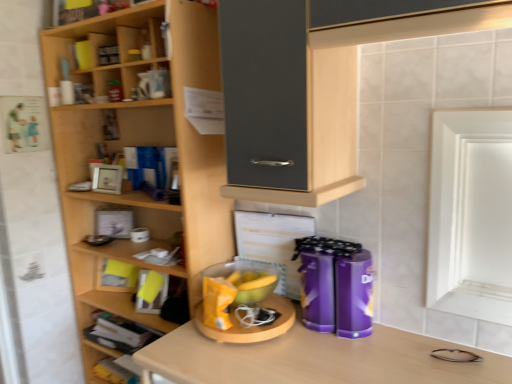
From the picture: Measure the distance between wooden books at lower left, which ranks as the 2th shelf in top-to-bottom order, and camera.

wooden books at lower left, which ranks as the 2th shelf in top-to-bottom order, is 1.75 meters away from camera.

Where is `wooden books at lower left, the second shelf positioned from the bottom`? The image size is (512, 384). wooden books at lower left, the second shelf positioned from the bottom is located at coordinates (120, 332).

The image size is (512, 384). What do you see at coordinates (139, 145) in the screenshot?
I see `wooden shelves at left, arranged as the 1th shelf when viewed from the top` at bounding box center [139, 145].

The height and width of the screenshot is (384, 512). Describe the element at coordinates (335, 286) in the screenshot. I see `purple glossy canisters at center, placed as the second appliance when sorted from left to right` at that location.

Locate an element on the screen. wooden books at lower left, which ranks as the 2th shelf in top-to-bottom order is located at coordinates [x=120, y=332].

Based on the photo, would you say purple glossy canisters at center, arranged as the first appliance when viewed from the right, is part of wooden books at lower left, which ranks as the 2th shelf in top-to-bottom order,'s contents?

No, purple glossy canisters at center, arranged as the first appliance when viewed from the right, is located outside of wooden books at lower left, which ranks as the 2th shelf in top-to-bottom order.

Considering the relative sizes of wooden books at lower left, which ranks as the 2th shelf in top-to-bottom order, and purple glossy canisters at center, arranged as the first appliance when viewed from the right, in the image provided, is wooden books at lower left, which ranks as the 2th shelf in top-to-bottom order, shorter than purple glossy canisters at center, arranged as the first appliance when viewed from the right,?

Yes.

From the image's perspective, does wooden books at lower left, which ranks as the 2th shelf in top-to-bottom order, appear lower than purple glossy canisters at center, arranged as the first appliance when viewed from the right?

Yes, from the image's perspective, wooden books at lower left, which ranks as the 2th shelf in top-to-bottom order, is beneath purple glossy canisters at center, arranged as the first appliance when viewed from the right.

Between wooden books at lower left, the second shelf positioned from the bottom, and purple glossy canisters at center, placed as the second appliance when sorted from left to right, which one appears on the right side from the viewer's perspective?

purple glossy canisters at center, placed as the second appliance when sorted from left to right.

Does wooden desk at center come behind wooden shelf at lower left, acting as the 3th shelf starting from the top?

That is False.

From the image's perspective, which one is positioned higher, wooden desk at center or wooden shelf at lower left, acting as the 3th shelf starting from the top?

wooden desk at center is shown above in the image.

From a real-world perspective, does wooden desk at center sit lower than wooden shelf at lower left, which is the 1th shelf from bottom to top?

Actually, wooden desk at center is physically above wooden shelf at lower left, which is the 1th shelf from bottom to top, in the real world.

Considering the sizes of objects purple glossy canisters at center, arranged as the first appliance when viewed from the right, and wooden books at lower left, the second shelf positioned from the bottom, in the image provided, who is smaller, purple glossy canisters at center, arranged as the first appliance when viewed from the right, or wooden books at lower left, the second shelf positioned from the bottom,?

With smaller size is purple glossy canisters at center, arranged as the first appliance when viewed from the right.

Which is more to the right, purple glossy canisters at center, arranged as the first appliance when viewed from the right, or wooden books at lower left, the second shelf positioned from the bottom?

Positioned to the right is purple glossy canisters at center, arranged as the first appliance when viewed from the right.

Does purple glossy canisters at center, placed as the second appliance when sorted from left to right, have a lesser height compared to wooden books at lower left, the second shelf positioned from the bottom?

In fact, purple glossy canisters at center, placed as the second appliance when sorted from left to right, may be taller than wooden books at lower left, the second shelf positioned from the bottom.

Could you tell me if purple glossy canisters at center, arranged as the first appliance when viewed from the right, is turned towards wooden books at lower left, which ranks as the 2th shelf in top-to-bottom order?

No.

Consider the image. Measure the distance from wooden shelves at left, arranged as the 1th shelf when viewed from the top, to wooden books at lower left, which ranks as the 2th shelf in top-to-bottom order.

wooden shelves at left, arranged as the 1th shelf when viewed from the top, is 21.21 inches from wooden books at lower left, which ranks as the 2th shelf in top-to-bottom order.

Based on their sizes in the image, would you say wooden shelves at left, arranged as the 1th shelf when viewed from the top, is bigger or smaller than wooden books at lower left, the second shelf positioned from the bottom?

Considering their sizes, wooden shelves at left, arranged as the 1th shelf when viewed from the top, takes up more space than wooden books at lower left, the second shelf positioned from the bottom.

Find the location of a particular element. shelf in front of the wooden books at lower left, which ranks as the 2th shelf in top-to-bottom order is located at coordinates (x=139, y=145).

Is wooden shelves at left, the third shelf positioned from the bottom, positioned with its back to wooden books at lower left, which ranks as the 2th shelf in top-to-bottom order?

Yes.

Which of these two, wooden books at lower left, which ranks as the 2th shelf in top-to-bottom order, or wooden shelf at lower left, which is the 1th shelf from bottom to top, is bigger?

With larger size is wooden books at lower left, which ranks as the 2th shelf in top-to-bottom order.

Who is shorter, wooden books at lower left, the second shelf positioned from the bottom, or wooden shelf at lower left, acting as the 3th shelf starting from the top?

Standing shorter between the two is wooden shelf at lower left, acting as the 3th shelf starting from the top.

Considering the points (111, 341) and (102, 379), which point is behind, point (111, 341) or point (102, 379)?

Positioned behind is point (102, 379).

The width and height of the screenshot is (512, 384). Find the location of `shelf below the wooden books at lower left, which ranks as the 2th shelf in top-to-bottom order (from the image's perspective)`. shelf below the wooden books at lower left, which ranks as the 2th shelf in top-to-bottom order (from the image's perspective) is located at coordinates (111, 359).

Is wooden books at lower left, which ranks as the 2th shelf in top-to-bottom order, located outside yellow matte bowl at center, the second appliance when ordered from right to left?

Yes.

Is wooden books at lower left, the second shelf positioned from the bottom, shorter than yellow matte bowl at center, the second appliance when ordered from right to left?

No, wooden books at lower left, the second shelf positioned from the bottom, is not shorter than yellow matte bowl at center, the second appliance when ordered from right to left.

From the picture: Is wooden books at lower left, the second shelf positioned from the bottom, beside yellow matte bowl at center, the second appliance when ordered from right to left?

wooden books at lower left, the second shelf positioned from the bottom, and yellow matte bowl at center, the second appliance when ordered from right to left, are not in contact.

From a real-world perspective, is wooden books at lower left, the second shelf positioned from the bottom, below yellow matte bowl at center, the second appliance when ordered from right to left?

Yes, from a real-world perspective, wooden books at lower left, the second shelf positioned from the bottom, is below yellow matte bowl at center, the second appliance when ordered from right to left.

Between yellow matte bowl at center, the 1th appliance in the left-to-right sequence, and wooden shelf at lower left, acting as the 3th shelf starting from the top, which one has smaller width?

yellow matte bowl at center, the 1th appliance in the left-to-right sequence, is thinner.

Considering the positions of objects yellow matte bowl at center, the second appliance when ordered from right to left, and wooden shelf at lower left, which is the 1th shelf from bottom to top, in the image provided, who is behind, yellow matte bowl at center, the second appliance when ordered from right to left, or wooden shelf at lower left, which is the 1th shelf from bottom to top,?

wooden shelf at lower left, which is the 1th shelf from bottom to top.

Visually, is yellow matte bowl at center, the second appliance when ordered from right to left, positioned to the left or to the right of wooden shelf at lower left, acting as the 3th shelf starting from the top?

yellow matte bowl at center, the second appliance when ordered from right to left, is to the right of wooden shelf at lower left, acting as the 3th shelf starting from the top.

What's the angular difference between yellow matte bowl at center, the second appliance when ordered from right to left, and wooden shelf at lower left, which is the 1th shelf from bottom to top,'s facing directions?

They differ by 1.15 degrees in their facing directions.

You are a GUI agent. You are given a task and a screenshot of the screen. Output one action in this format:
    pyautogui.click(x=<x>, y=<y>)
    Task: Click on the 1st shelf positioned below the purple glossy canisters at center, placed as the second appliance when sorted from left to right (from the image's perspective)
    Image resolution: width=512 pixels, height=384 pixels.
    Given the screenshot: What is the action you would take?
    pyautogui.click(x=120, y=332)

Locate an element on the screen. This screenshot has height=384, width=512. the 2nd shelf directly beneath the wooden desk at center (from a real-world perspective) is located at coordinates (111, 359).

Considering their positions, is purple glossy canisters at center, placed as the second appliance when sorted from left to right, positioned further to yellow matte bowl at center, the 1th appliance in the left-to-right sequence, than wooden shelves at left, arranged as the 1th shelf when viewed from the top?

wooden shelves at left, arranged as the 1th shelf when viewed from the top, is further to yellow matte bowl at center, the 1th appliance in the left-to-right sequence.

Based on their spatial positions, is wooden shelves at left, arranged as the 1th shelf when viewed from the top, or purple glossy canisters at center, placed as the second appliance when sorted from left to right, further from wooden desk at center?

wooden shelves at left, arranged as the 1th shelf when viewed from the top, lies further to wooden desk at center than the other object.

From the picture: Based on their spatial positions, is wooden shelf at lower left, which is the 1th shelf from bottom to top, or wooden books at lower left, which ranks as the 2th shelf in top-to-bottom order, further from purple glossy canisters at center, arranged as the first appliance when viewed from the right?

The object further to purple glossy canisters at center, arranged as the first appliance when viewed from the right, is wooden shelf at lower left, which is the 1th shelf from bottom to top.

When comparing their distances from wooden desk at center, does yellow matte bowl at center, the second appliance when ordered from right to left, or wooden shelves at left, arranged as the 1th shelf when viewed from the top, seem further?

Based on the image, wooden shelves at left, arranged as the 1th shelf when viewed from the top, appears to be further to wooden desk at center.

When comparing their distances from purple glossy canisters at center, arranged as the first appliance when viewed from the right, does yellow matte bowl at center, the 1th appliance in the left-to-right sequence, or wooden desk at center seem further?

The object further to purple glossy canisters at center, arranged as the first appliance when viewed from the right, is yellow matte bowl at center, the 1th appliance in the left-to-right sequence.

From the image, which object appears to be nearer to wooden shelf at lower left, which is the 1th shelf from bottom to top, yellow matte bowl at center, the second appliance when ordered from right to left, or wooden desk at center?

Based on the image, yellow matte bowl at center, the second appliance when ordered from right to left, appears to be nearer to wooden shelf at lower left, which is the 1th shelf from bottom to top.

Based on the photo, based on their spatial positions, is wooden shelves at left, arranged as the 1th shelf when viewed from the top, or wooden shelf at lower left, acting as the 3th shelf starting from the top, further from wooden desk at center?

Among the two, wooden shelf at lower left, acting as the 3th shelf starting from the top, is located further to wooden desk at center.

Based on their spatial positions, is wooden shelf at lower left, which is the 1th shelf from bottom to top, or purple glossy canisters at center, placed as the second appliance when sorted from left to right, further from wooden books at lower left, the second shelf positioned from the bottom?

Based on the image, purple glossy canisters at center, placed as the second appliance when sorted from left to right, appears to be further to wooden books at lower left, the second shelf positioned from the bottom.

At what (x,y) coordinates should I click in order to perform the action: click on appliance between purple glossy canisters at center, arranged as the first appliance when viewed from the right, and wooden desk at center, in the vertical direction. Please return your answer as a coordinate pair (x, y). The image size is (512, 384). Looking at the image, I should click on (243, 303).

Where is `appliance between wooden books at lower left, the second shelf positioned from the bottom, and purple glossy canisters at center, arranged as the first appliance when viewed from the right`? The image size is (512, 384). appliance between wooden books at lower left, the second shelf positioned from the bottom, and purple glossy canisters at center, arranged as the first appliance when viewed from the right is located at coordinates (243, 303).

I want to click on appliance between wooden shelves at left, arranged as the 1th shelf when viewed from the top, and purple glossy canisters at center, placed as the second appliance when sorted from left to right, in the horizontal direction, so click(243, 303).

At what (x,y) coordinates should I click in order to perform the action: click on shelf situated between wooden books at lower left, which ranks as the 2th shelf in top-to-bottom order, and purple glossy canisters at center, arranged as the first appliance when viewed from the right, from left to right. Please return your answer as a coordinate pair (x, y). Looking at the image, I should click on (139, 145).